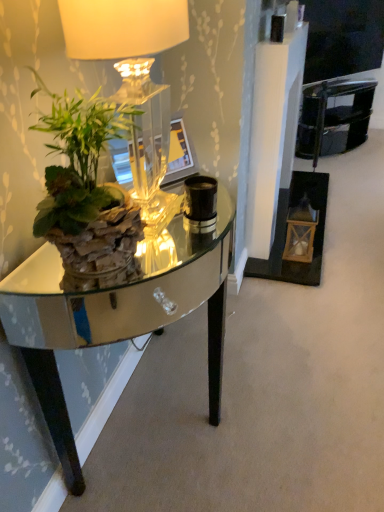
Question: Considering the relative positions of clear glass table at left and matte glass lamp at upper left in the image provided, is clear glass table at left to the right of matte glass lamp at upper left from the viewer's perspective?

Choices:
 (A) yes
 (B) no

Answer: (A)

Question: From a real-world perspective, is clear glass table at left beneath matte glass lamp at upper left?

Choices:
 (A) no
 (B) yes

Answer: (B)

Question: Is the position of clear glass table at left more distant than that of matte glass lamp at upper left?

Choices:
 (A) yes
 (B) no

Answer: (A)

Question: Is clear glass table at left smaller than matte glass lamp at upper left?

Choices:
 (A) no
 (B) yes

Answer: (A)

Question: Is clear glass table at left thinner than matte glass lamp at upper left?

Choices:
 (A) no
 (B) yes

Answer: (A)

Question: Does point (61, 116) appear closer or farther from the camera than point (362, 86)?

Choices:
 (A) closer
 (B) farther

Answer: (A)

Question: From the image's perspective, is green leafy plant at left located above or below black glossy armchair at upper right?

Choices:
 (A) below
 (B) above

Answer: (A)

Question: Is green leafy plant at left inside the boundaries of black glossy armchair at upper right, or outside?

Choices:
 (A) inside
 (B) outside

Answer: (B)

Question: From their relative heights in the image, would you say green leafy plant at left is taller or shorter than black glossy armchair at upper right?

Choices:
 (A) tall
 (B) short

Answer: (B)

Question: Relative to green leafy plant at left, is matte glass lamp at upper left in front or behind?

Choices:
 (A) behind
 (B) front

Answer: (A)

Question: From a real-world perspective, is matte glass lamp at upper left above or below green leafy plant at left?

Choices:
 (A) below
 (B) above

Answer: (B)

Question: Considering the positions of point (165, 9) and point (66, 202), is point (165, 9) closer or farther from the camera than point (66, 202)?

Choices:
 (A) farther
 (B) closer

Answer: (B)

Question: From the image's perspective, is matte glass lamp at upper left positioned above or below green leafy plant at left?

Choices:
 (A) above
 (B) below

Answer: (A)

Question: In terms of height, does clear glass table at left look taller or shorter compared to green leafy plant at left?

Choices:
 (A) short
 (B) tall

Answer: (B)

Question: From the image's perspective, is clear glass table at left located above or below green leafy plant at left?

Choices:
 (A) above
 (B) below

Answer: (B)